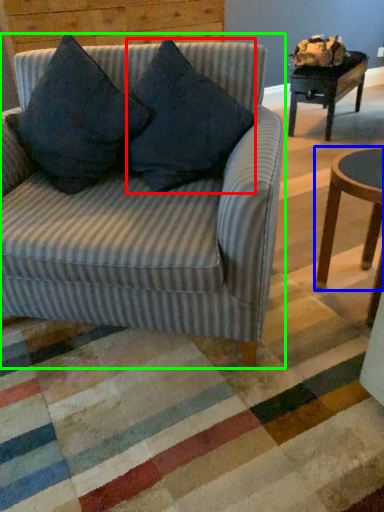
Question: Which object is the farthest from throw pillow (highlighted by a red box)? Choose among these: coffee table (highlighted by a blue box) or studio couch (highlighted by a green box).

Choices:
 (A) coffee table
 (B) studio couch

Answer: (A)